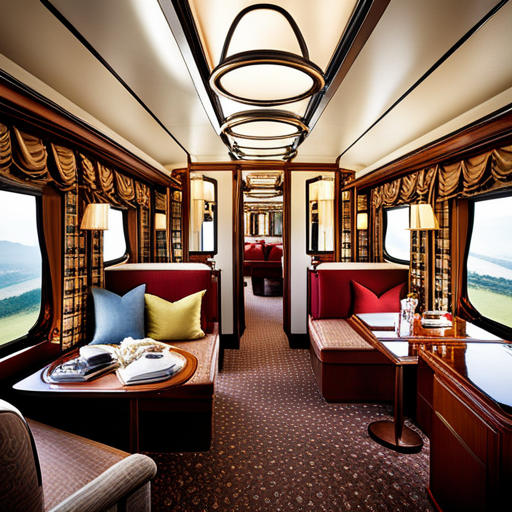
Locate an element on the screen. floor is located at coordinates (297, 407).